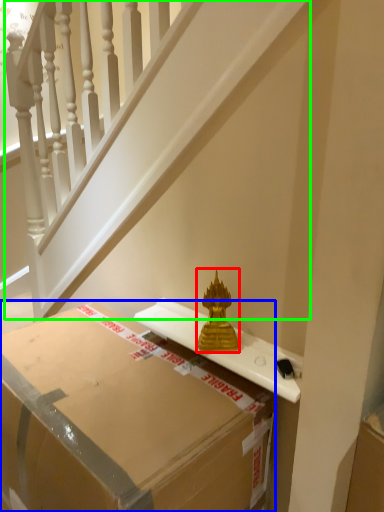
Question: Which is nearer to the sculpture (highlighted by a red box)? box (highlighted by a blue box) or stairwell (highlighted by a green box).

Choices:
 (A) box
 (B) stairwell

Answer: (A)